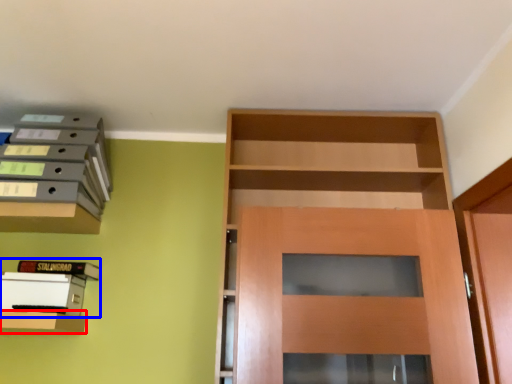
Question: Which of the following is the closest to the observer, shelf (highlighted by a red box) or book (highlighted by a blue box)?

Choices:
 (A) shelf
 (B) book

Answer: (A)